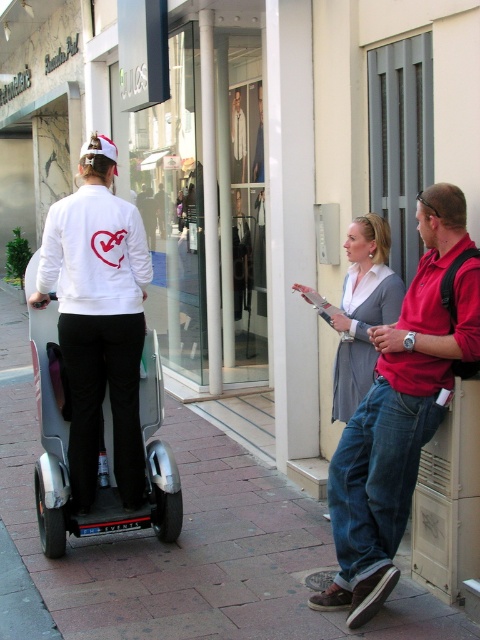
Is red shirt at right shorter than silver metallic scooter at left?

No.

Who is lower down, red shirt at right or silver metallic scooter at left?

silver metallic scooter at left is below.

This screenshot has width=480, height=640. In order to click on red shirt at right in this screenshot , I will do `click(400, 410)`.

Can you confirm if brick pavement at center is positioned above red shirt at right?

Actually, brick pavement at center is below red shirt at right.

Does point (11, 490) come closer to viewer compared to point (346, 540)?

No, (11, 490) is further to viewer.

The height and width of the screenshot is (640, 480). Find the location of `brick pavement at center`. brick pavement at center is located at coordinates (189, 541).

Which is in front, point (132, 547) or point (52, 356)?

Positioned in front is point (52, 356).

Looking at this image, can you confirm if brick pavement at center is bigger than silver metallic scooter at left?

Incorrect, brick pavement at center is not larger than silver metallic scooter at left.

Identify the location of brick pavement at center. (189, 541).